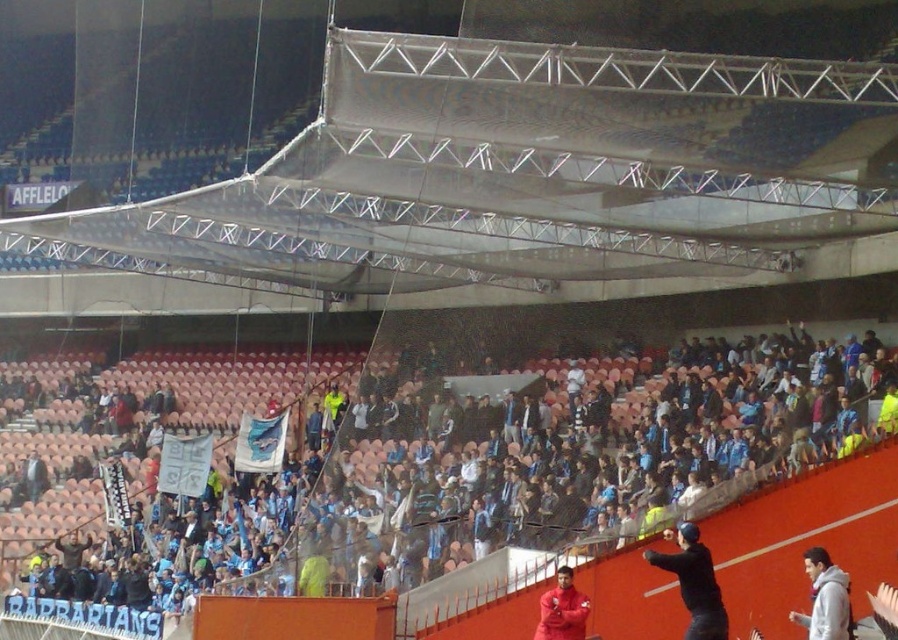
Question: Does gray fleece jacket at lower right appear on the right side of matte red jacket at lower center?

Choices:
 (A) no
 (B) yes

Answer: (B)

Question: Estimate the real-world distances between objects in this image. Which object is farther from the black matte jacket at lower right?

Choices:
 (A) gray fleece jacket at lower right
 (B) blue fabric crowd at center

Answer: (B)

Question: Which point is closer to the camera?

Choices:
 (A) (575, 630)
 (B) (694, 564)
 (C) (794, 436)
 (D) (817, 620)

Answer: (D)

Question: Can you confirm if black matte jacket at lower right is smaller than gray fleece jacket at lower right?

Choices:
 (A) no
 (B) yes

Answer: (A)

Question: Which of these objects is positioned closest to the gray fleece jacket at lower right?

Choices:
 (A) matte red jacket at lower center
 (B) blue fabric crowd at center

Answer: (A)

Question: Observing the image, what is the correct spatial positioning of blue fabric crowd at center in reference to gray fleece jacket at lower right?

Choices:
 (A) left
 (B) right

Answer: (A)